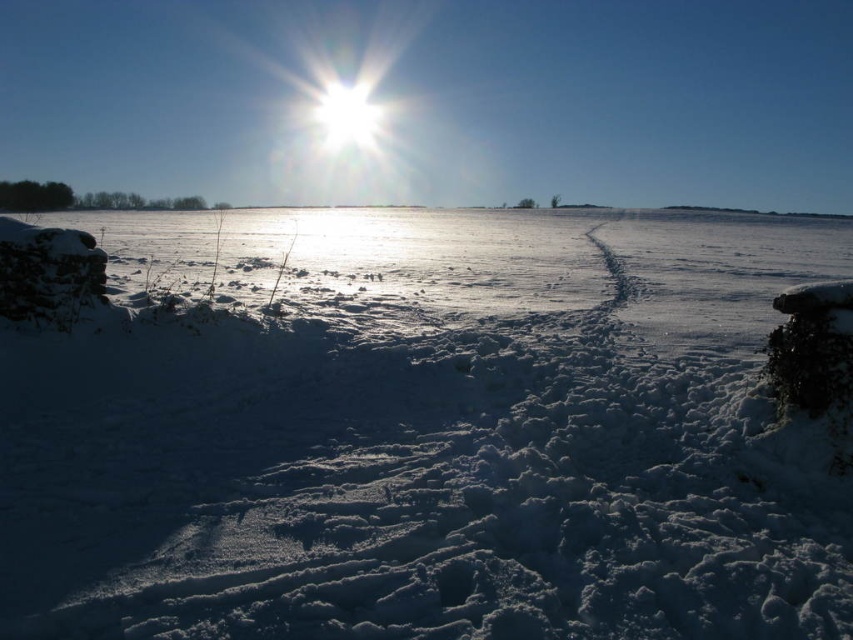
Can you confirm if white fluffy snow at center is positioned to the left of white glossy sun at upper center?

Incorrect, white fluffy snow at center is not on the left side of white glossy sun at upper center.

Can you confirm if white fluffy snow at center is taller than white glossy sun at upper center?

Incorrect, white fluffy snow at center's height is not larger of white glossy sun at upper center's.

Which is behind, point (619, 596) or point (331, 88)?

The point (331, 88) is more distant.

Identify the location of white fluffy snow at center. Image resolution: width=853 pixels, height=640 pixels. (422, 435).